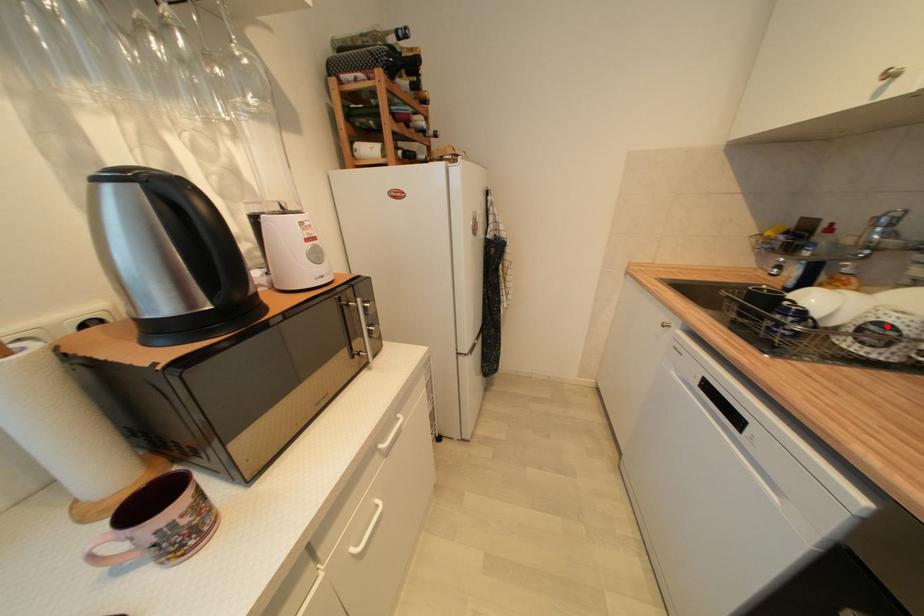
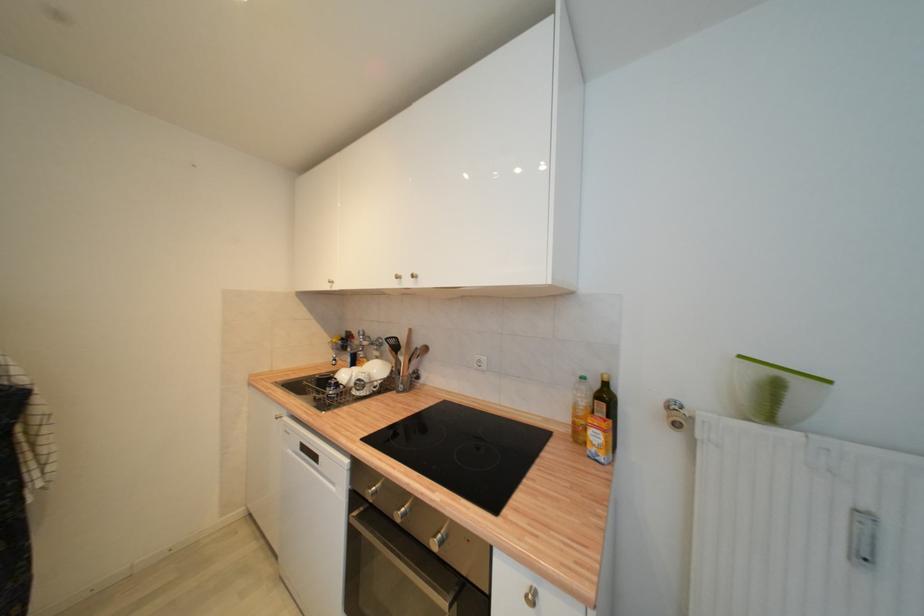
In the second image, find the point that corresponds to the highlighted location in the first image.

(363, 382)